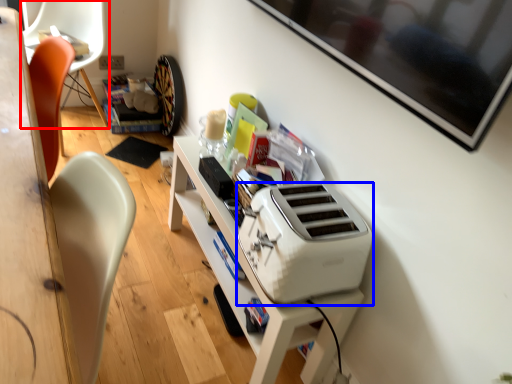
Question: Among these objects, which one is nearest to the camera, chair (highlighted by a red box) or home appliance (highlighted by a blue box)?

Choices:
 (A) chair
 (B) home appliance

Answer: (B)